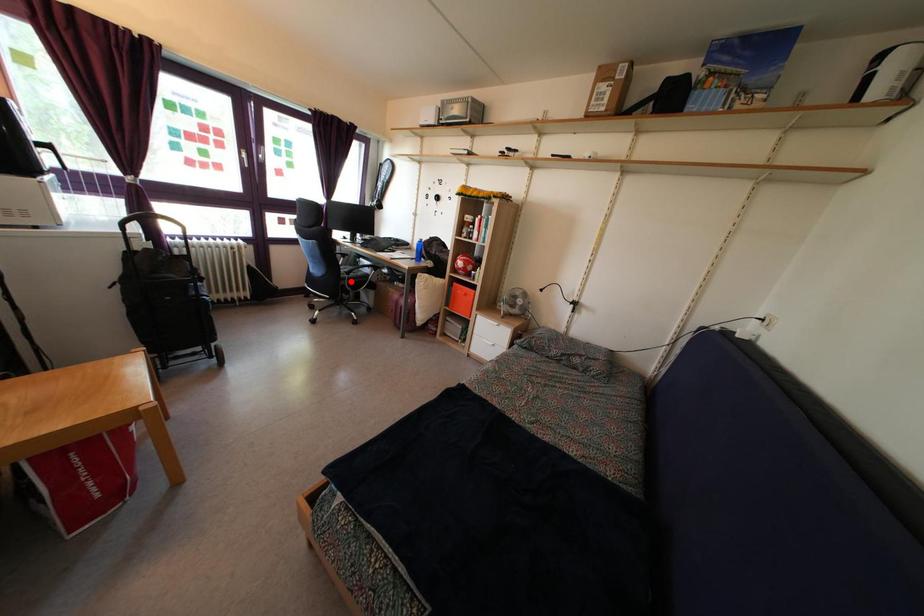
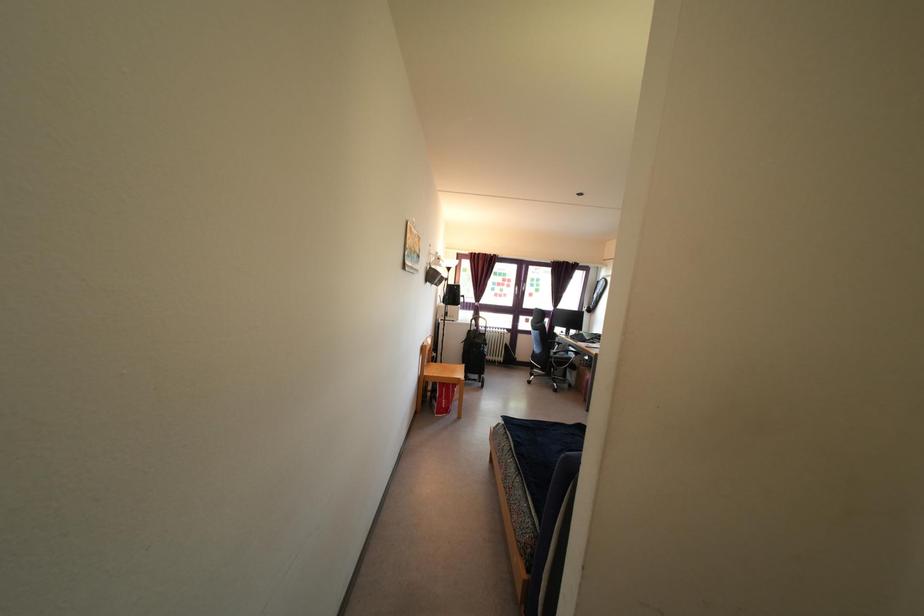
In the second image, find the point that corresponds to the highlighted location in the first image.

(557, 362)